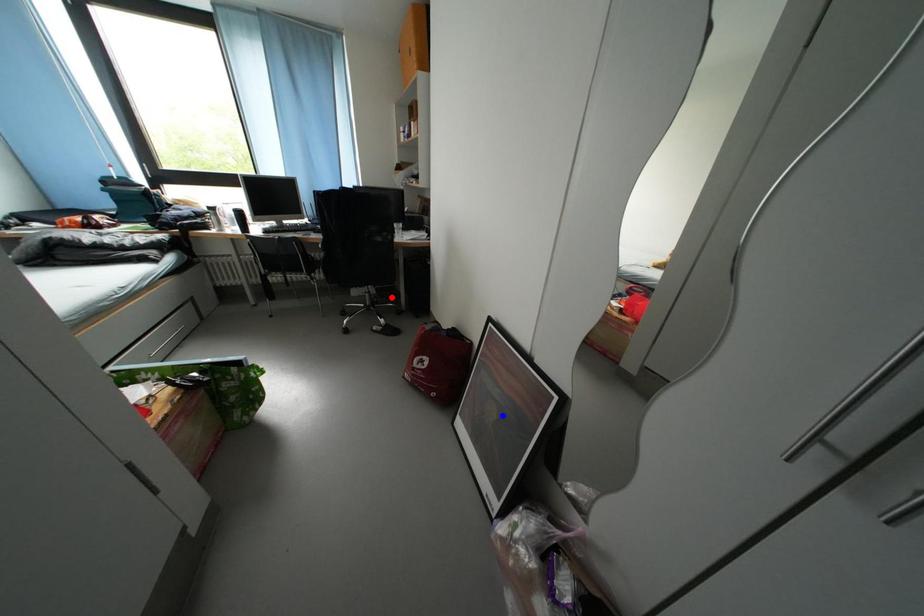
Question: Which of the two points in the image is closer to the camera?

Choices:
 (A) Blue point is closer.
 (B) Red point is closer.

Answer: (A)